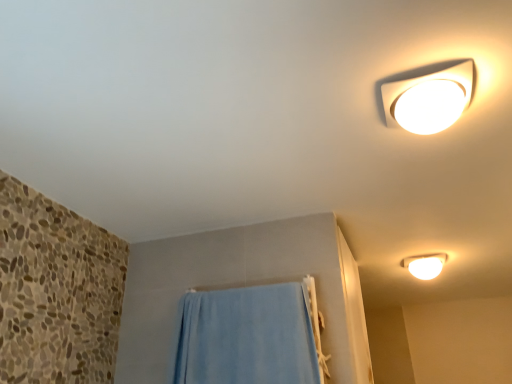
Question: Can you confirm if white glossy ceiling light at upper right, the second lamp from the right, is bigger than blue fabric towel at lower center?

Choices:
 (A) yes
 (B) no

Answer: (B)

Question: Is white glossy ceiling light at upper right, which ranks as the 1th lamp in top-to-bottom order, looking in the opposite direction of blue fabric towel at lower center?

Choices:
 (A) no
 (B) yes

Answer: (A)

Question: Can you confirm if white glossy ceiling light at upper right, the 2th lamp positioned from the bottom, is thinner than blue fabric towel at lower center?

Choices:
 (A) no
 (B) yes

Answer: (A)

Question: Does white glossy ceiling light at upper right, the 2th lamp positioned from the bottom, turn towards blue fabric towel at lower center?

Choices:
 (A) yes
 (B) no

Answer: (B)

Question: From a real-world perspective, is white glossy ceiling light at upper right, arranged as the 1th lamp when viewed from the left, physically below blue fabric towel at lower center?

Choices:
 (A) yes
 (B) no

Answer: (B)

Question: Is white glossy ceiling light at upper right, the 2th lamp positioned from the bottom, not close to blue fabric towel at lower center?

Choices:
 (A) no
 (B) yes

Answer: (A)

Question: Is white glossy light fixture at upper right, the second lamp from the front, with blue fabric towel at lower center?

Choices:
 (A) yes
 (B) no

Answer: (B)

Question: From the image's perspective, does white glossy light fixture at upper right, the first lamp positioned from the right, appear lower than blue fabric towel at lower center?

Choices:
 (A) no
 (B) yes

Answer: (A)

Question: Can you confirm if white glossy light fixture at upper right, the first lamp positioned from the right, is taller than blue fabric towel at lower center?

Choices:
 (A) yes
 (B) no

Answer: (B)

Question: From the image's perspective, does white glossy light fixture at upper right, placed as the second lamp when sorted from left to right, appear higher than blue fabric towel at lower center?

Choices:
 (A) no
 (B) yes

Answer: (B)

Question: From a real-world perspective, is white glossy light fixture at upper right, marked as the 2th lamp in a top-to-bottom arrangement, physically above blue fabric towel at lower center?

Choices:
 (A) no
 (B) yes

Answer: (B)

Question: Is white glossy light fixture at upper right, which ranks as the 1th lamp in back-to-front order, oriented towards blue fabric towel at lower center?

Choices:
 (A) yes
 (B) no

Answer: (B)

Question: Considering the relative positions of blue fabric towel at lower center and white glossy light fixture at upper right, placed as the second lamp when sorted from left to right, in the image provided, is blue fabric towel at lower center to the left of white glossy light fixture at upper right, placed as the second lamp when sorted from left to right, from the viewer's perspective?

Choices:
 (A) yes
 (B) no

Answer: (A)